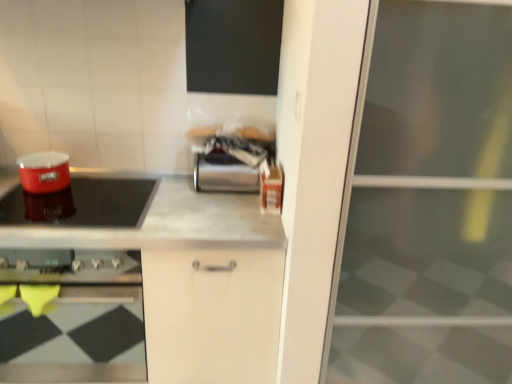
Locate an element on the screen. The height and width of the screenshot is (384, 512). free space in front of satin silver canister at center, which is the 1th appliance from right to left is located at coordinates (222, 209).